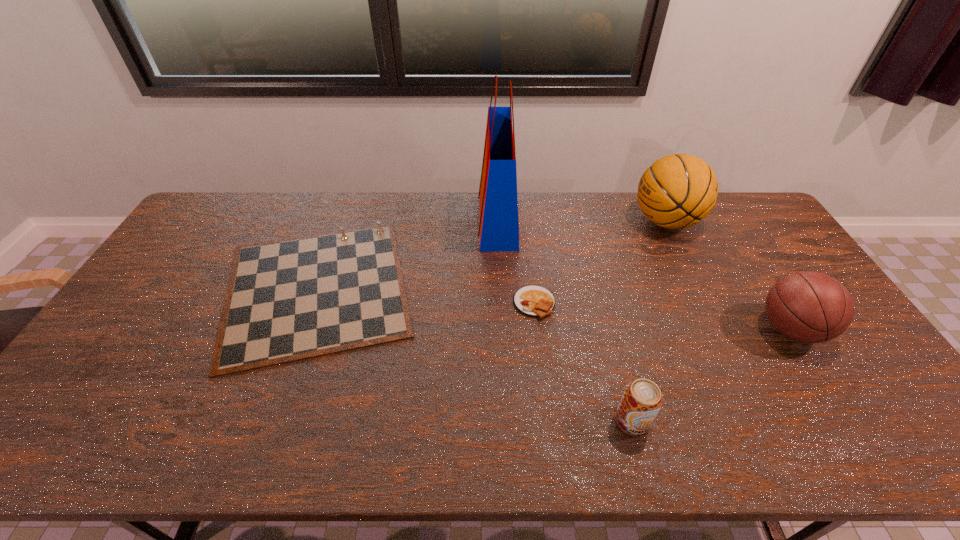
The width and height of the screenshot is (960, 540). I want to click on vacant space located 0.390m on the handle side of the shopping bag, so click(370, 220).

Find the location of a particular element. vacant space situated 0.280m on the handle side of the shopping bag is located at coordinates (400, 220).

Image resolution: width=960 pixels, height=540 pixels. Identify the location of free space located on the handle side of the shopping bag. (400, 220).

Locate an element on the screen. This screenshot has height=540, width=960. blank area located 0.170m on the surface of the farther basketball near the brand logo is located at coordinates (584, 221).

Locate an element on the screen. free space located 0.180m on the surface of the farther basketball near the brand logo is located at coordinates (581, 221).

Identify the location of vacant space situated 0.100m on the surface of the farther basketball near the brand logo. This screenshot has height=540, width=960. (603, 221).

This screenshot has width=960, height=540. I want to click on free space located on the back of the shorter basketball, so click(724, 224).

This screenshot has height=540, width=960. What are the coordinates of `vacant space situated 0.120m on the left of the third shortest object` in the screenshot? It's located at (564, 421).

Image resolution: width=960 pixels, height=540 pixels. Identify the location of vacant area situated 0.050m on the left of the gameboard. (196, 288).

Find the location of a particular element. This screenshot has height=540, width=960. free spot located 0.050m on the left of the shortest object is located at coordinates (495, 303).